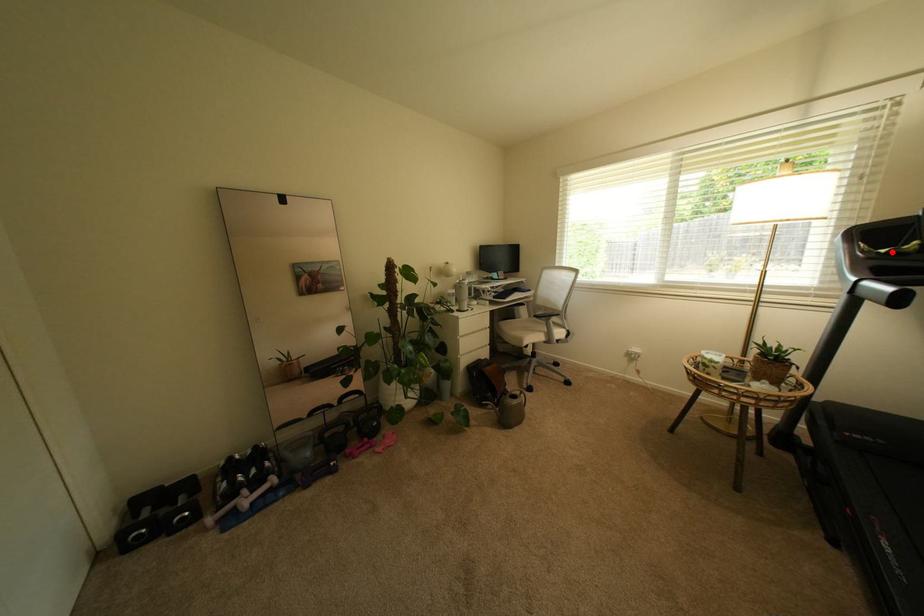
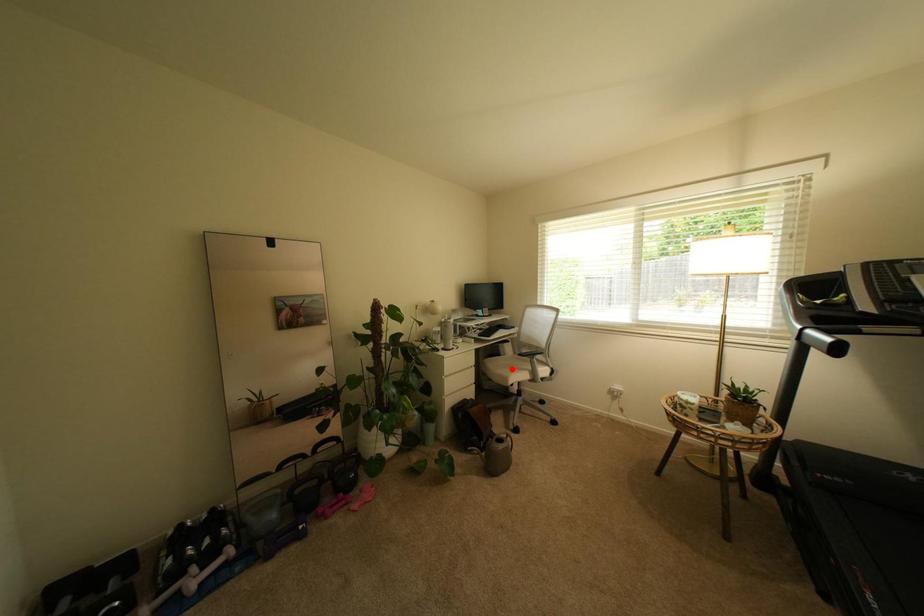
I am providing you with two images of the same scene from different viewpoints. A red point is marked on the first image and another point is marked on the second image. Do the highlighted points in image1 and image2 indicate the same real-world spot?

No